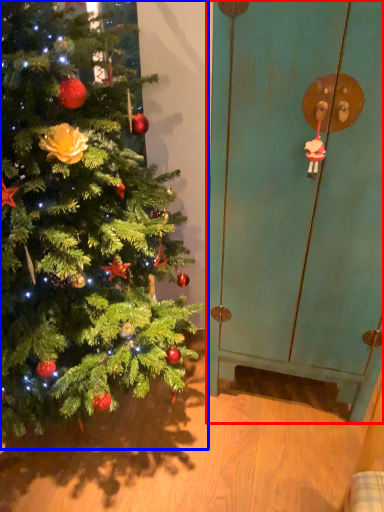
Question: Which object appears closest to the camera in this image, screen door (highlighted by a red box) or christmas tree (highlighted by a blue box)?

Choices:
 (A) screen door
 (B) christmas tree

Answer: (B)